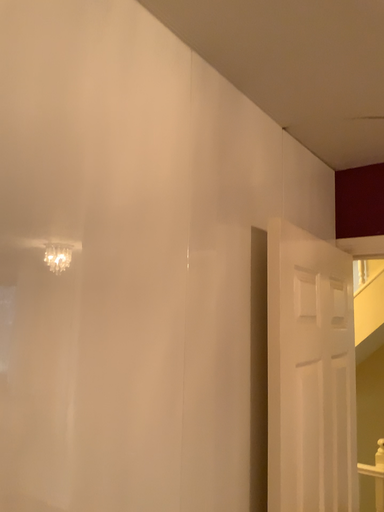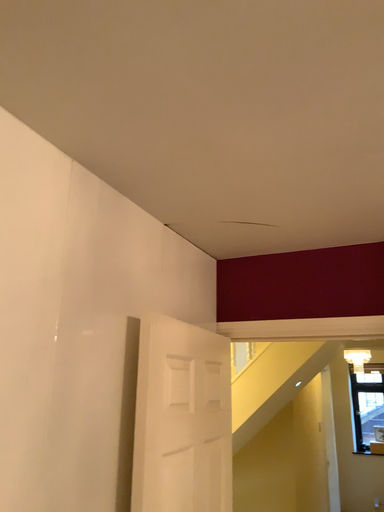
Question: How did the camera likely rotate when shooting the video?

Choices:
 (A) rotated right
 (B) rotated left

Answer: (A)